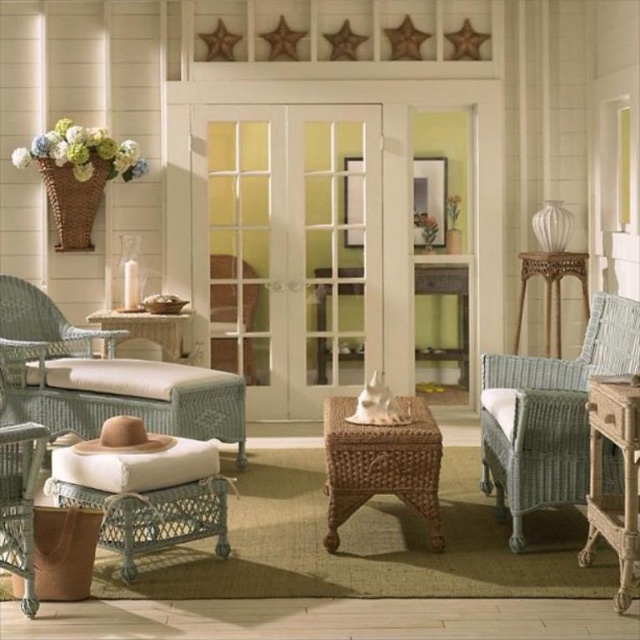
You are planning to place a large potted plant in the living room. You have two options for placement next to either the woven light blue armchair at right or the woven wicker armchair at center. Considering their sizes, which armchair has more space around it to accommodate the plant?

The woven light blue armchair at right has a larger size compared to the woven wicker armchair at center, so it likely has more space around it to accommodate the plant.

You are a visitor entering the room and want to sit down. You see the woven light blue armchair at right and the white wicker stool at lower left. Which one is closer to you?

The woven light blue armchair at right is closer to you because it is further to the viewer than the white wicker stool at lower left, meaning it is positioned nearer in the room.